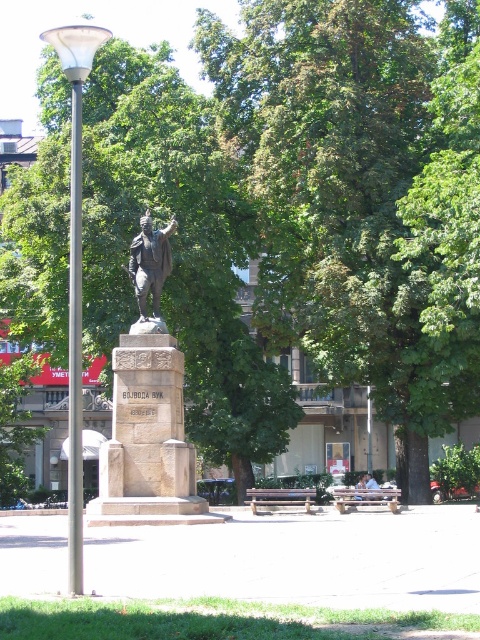
You are a visitor in the park and want to sit on the light brown wooden bench at center. From the polished bronze statue at center, which direction should you walk to reach the bench?

The polished bronze statue at center is to the left of the light brown wooden bench at center, so you should walk to the right to reach the bench.

You are standing in the park and want to place a new bench between the two points labeled point (x=284, y=500) and point (x=374, y=497). Since you want the bench to be as close as possible to the statue, which point should you place it closer to?

To place the bench as close as possible to the statue, you should position it closer to point (x=284, y=500) because it is nearer to the viewer compared to point (x=374, y=497). Since the statue is the central feature in the park, being closer to the viewer would mean it is physically nearer to the statue.